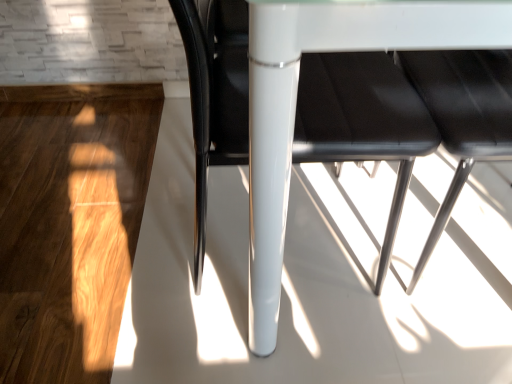
Question: Does white glossy table at center come behind glossy black chair at center?

Choices:
 (A) no
 (B) yes

Answer: (A)

Question: Is white glossy table at center to the left of glossy black chair at center from the viewer's perspective?

Choices:
 (A) no
 (B) yes

Answer: (A)

Question: Can you confirm if white glossy table at center is wider than glossy black chair at center?

Choices:
 (A) yes
 (B) no

Answer: (A)

Question: Can you confirm if white glossy table at center is shorter than glossy black chair at center?

Choices:
 (A) no
 (B) yes

Answer: (A)

Question: Is white glossy table at center smaller than glossy black chair at center?

Choices:
 (A) yes
 (B) no

Answer: (B)

Question: Can we say white glossy table at center lies outside glossy black chair at center?

Choices:
 (A) no
 (B) yes

Answer: (B)

Question: Does glossy black chair at center have a greater height compared to white glossy table at center?

Choices:
 (A) no
 (B) yes

Answer: (A)

Question: Considering the relative positions of glossy black chair at center and white glossy table at center in the image provided, is glossy black chair at center to the right of white glossy table at center from the viewer's perspective?

Choices:
 (A) yes
 (B) no

Answer: (B)

Question: Does glossy black chair at center turn towards white glossy table at center?

Choices:
 (A) yes
 (B) no

Answer: (A)

Question: Is glossy black chair at center facing away from white glossy table at center?

Choices:
 (A) no
 (B) yes

Answer: (B)

Question: From a real-world perspective, is glossy black chair at center on top of white glossy table at center?

Choices:
 (A) yes
 (B) no

Answer: (B)

Question: From the image's perspective, is glossy black chair at center on white glossy table at center?

Choices:
 (A) no
 (B) yes

Answer: (A)

Question: Is glossy black chair at center to the left or to the right of white glossy table at center in the image?

Choices:
 (A) right
 (B) left

Answer: (B)